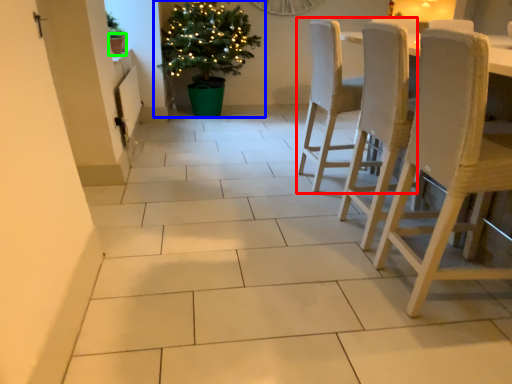
Question: Estimate the real-world distances between objects in this image. Which object is closer to chair (highlighted by a red box), houseplant (highlighted by a blue box) or flowerpot (highlighted by a green box)?

Choices:
 (A) houseplant
 (B) flowerpot

Answer: (A)